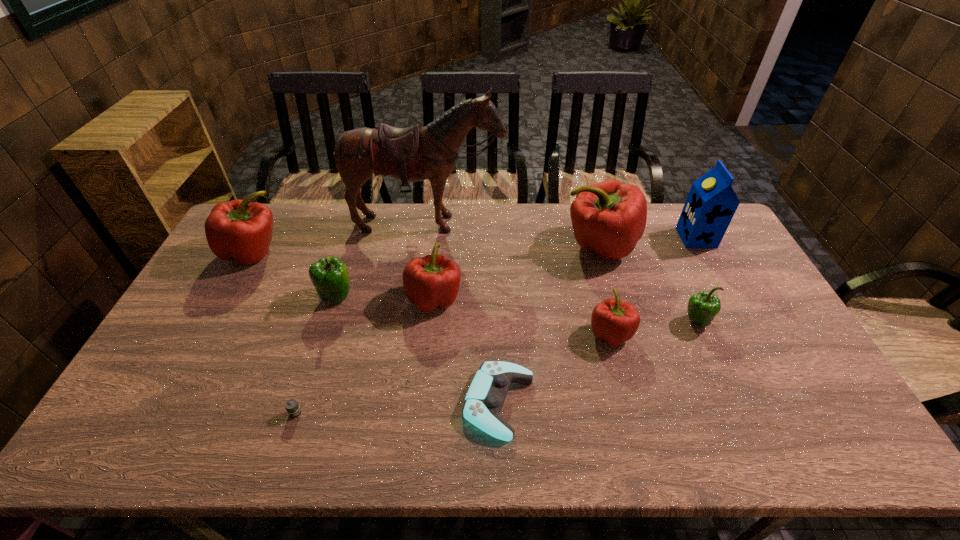
Where is `free location located on the right of the tallest bell pepper`? The image size is (960, 540). free location located on the right of the tallest bell pepper is located at coordinates pos(725,246).

I want to click on vacant region located 0.140m on the front of the second biggest pink bell pepper, so click(x=225, y=305).

Find the location of a particular element. vacant area situated on the back of the left green bell pepper is located at coordinates (357, 227).

You are a GUI agent. You are given a task and a screenshot of the screen. Output one action in this format:
    pyautogui.click(x=<x>, y=<y>)
    Task: Click on the vacant space located on the back of the second smallest pink bell pepper
    This screenshot has width=960, height=540.
    Given the screenshot: What is the action you would take?
    pyautogui.click(x=444, y=205)

Image resolution: width=960 pixels, height=540 pixels. In order to click on vacant area situated on the front of the right green bell pepper in this screenshot , I will do `click(734, 406)`.

Locate an element on the screen. free space located on the back of the smallest pink bell pepper is located at coordinates (594, 273).

Locate an element on the screen. The height and width of the screenshot is (540, 960). vacant area situated on the right of the ninth tallest object is located at coordinates (674, 403).

Find the location of a particular element. This screenshot has width=960, height=540. vacant point located 0.370m on the left of the beer can is located at coordinates (130, 413).

Locate an element on the screen. The width and height of the screenshot is (960, 540). saddle positioned at the far edge is located at coordinates (416, 153).

The height and width of the screenshot is (540, 960). I want to click on carton present at the far edge, so click(x=711, y=204).